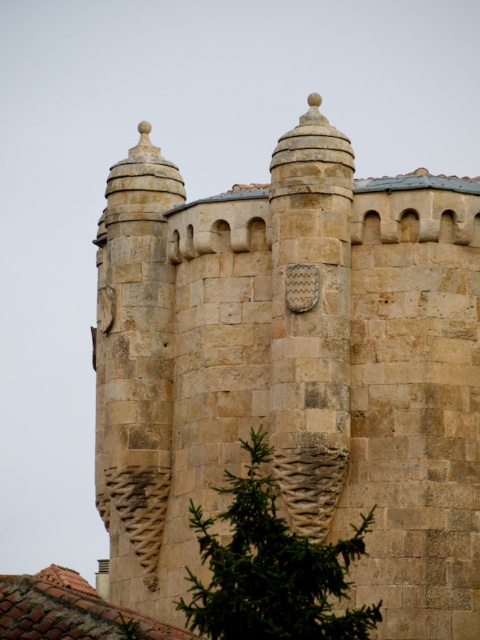
You are an architect examining a historic stone building. You notice two sections of stonework labeled as the stone textured castle at center and the green textured stone at center. Which section is wider?

The stone textured castle at center is wider than the green textured stone at center, as its width surpasses the latter.

You are an architect planning to install a decorative banner between the stone textured castle at center and the green textured stone at center. The banner requires a minimum of 5 meters of space to hang properly. Based on the scene description, will there be enough space between them to accommodate the banner?

The stone textured castle at center and the green textured stone at center are 6.79 meters apart from each other, which is more than the required 5 meters. Therefore, there is sufficient space to hang the banner between them.